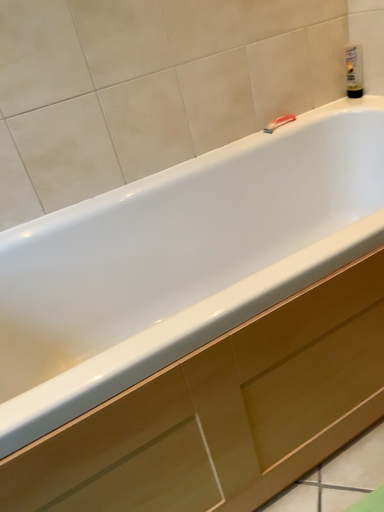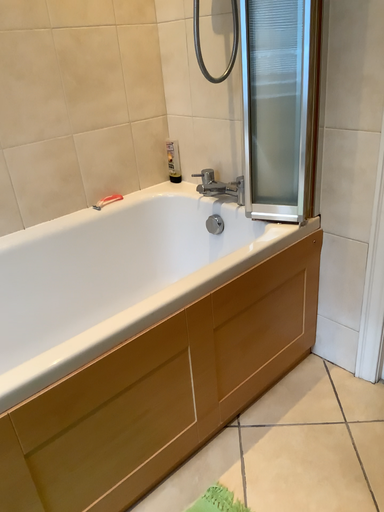
Question: Which way did the camera rotate in the video?

Choices:
 (A) rotated left
 (B) rotated right

Answer: (B)